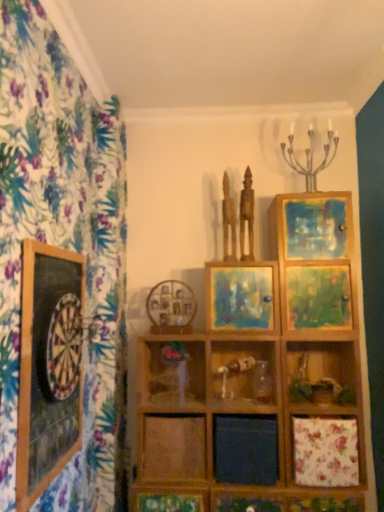
Question: Does matte brown statue at center, the 2th sculpture when ordered from left to right, have a lesser width compared to matte wooden picture frame at center, the second picture frame in the front-to-back sequence?

Choices:
 (A) no
 (B) yes

Answer: (B)

Question: From a real-world perspective, is matte brown statue at center, the 2th sculpture when ordered from left to right, positioned under matte wooden picture frame at center, the 2th picture frame in the back-to-front sequence, based on gravity?

Choices:
 (A) yes
 (B) no

Answer: (B)

Question: From the image's perspective, is matte brown statue at center, the first sculpture from the right, located beneath matte wooden picture frame at center, the 2th picture frame in the back-to-front sequence?

Choices:
 (A) no
 (B) yes

Answer: (A)

Question: Is matte brown statue at center, the first sculpture from the right, wider than matte wooden picture frame at center, which is the third picture frame from left to right?

Choices:
 (A) yes
 (B) no

Answer: (B)

Question: Does matte brown statue at center, the 2th sculpture when ordered from left to right, lie in front of matte wooden picture frame at center, arranged as the 1th picture frame when viewed from the right?

Choices:
 (A) no
 (B) yes

Answer: (A)

Question: Does matte brown statue at center, the first sculpture from the right, have a lesser height compared to matte wooden picture frame at center, the 2th picture frame in the back-to-front sequence?

Choices:
 (A) no
 (B) yes

Answer: (A)

Question: Does matte wooden picture frame at center, arranged as the 1th picture frame when viewed from the right, contain wooden statue at center, marked as the second sculpture in a right-to-left arrangement?

Choices:
 (A) no
 (B) yes

Answer: (A)

Question: From the image's perspective, is matte wooden picture frame at center, the 2th picture frame in the back-to-front sequence, under wooden statue at center, marked as the second sculpture in a right-to-left arrangement?

Choices:
 (A) no
 (B) yes

Answer: (B)

Question: Is matte wooden picture frame at center, the second picture frame in the front-to-back sequence, facing towards wooden statue at center, which is the 1th sculpture in left-to-right order?

Choices:
 (A) yes
 (B) no

Answer: (B)

Question: From a real-world perspective, is matte wooden picture frame at center, which is the third picture frame from left to right, on wooden statue at center, which is the 1th sculpture in left-to-right order?

Choices:
 (A) no
 (B) yes

Answer: (A)

Question: Can you confirm if matte wooden picture frame at center, the second picture frame in the front-to-back sequence, is smaller than wooden statue at center, marked as the second sculpture in a right-to-left arrangement?

Choices:
 (A) yes
 (B) no

Answer: (B)

Question: Is matte wooden picture frame at center, the second picture frame in the front-to-back sequence, facing away from wooden statue at center, which is the 1th sculpture in left-to-right order?

Choices:
 (A) no
 (B) yes

Answer: (A)

Question: Is there a large distance between wooden dartboard at left, arranged as the 1th picture frame when viewed from the left, and wooden picture frame at center, placed as the first picture frame when sorted from back to front?

Choices:
 (A) yes
 (B) no

Answer: (B)